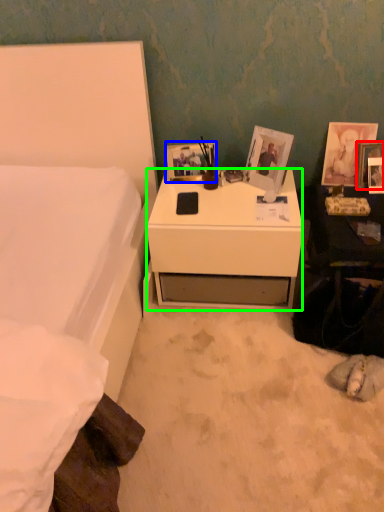
Question: Estimate the real-world distances between objects in this image. Which object is closer to picture frame (highlighted by a red box), picture frame (highlighted by a blue box) or desk (highlighted by a green box)?

Choices:
 (A) picture frame
 (B) desk

Answer: (B)